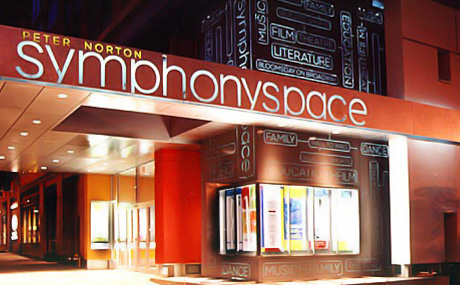
Locate an element on the screen. Image resolution: width=460 pixels, height=285 pixels. red wall is located at coordinates (x=164, y=214).